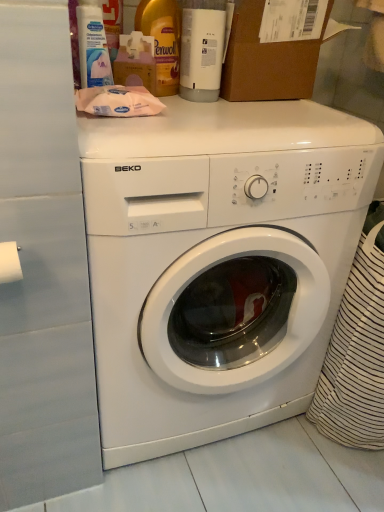
Question: Considering the relative positions of yellow plastic bottle at upper center, the 2th bottle from the right, and white plastic bottle at upper center, which ranks as the first bottle in right-to-left order, in the image provided, is yellow plastic bottle at upper center, the 2th bottle from the right, to the right of white plastic bottle at upper center, which ranks as the first bottle in right-to-left order, from the viewer's perspective?

Choices:
 (A) no
 (B) yes

Answer: (A)

Question: Is yellow plastic bottle at upper center, which ranks as the 1th bottle in left-to-right order, closer to camera compared to white plastic bottle at upper center, which ranks as the first bottle in right-to-left order?

Choices:
 (A) no
 (B) yes

Answer: (A)

Question: Does yellow plastic bottle at upper center, the 2th bottle from the right, have a lesser height compared to white plastic bottle at upper center, acting as the second bottle starting from the left?

Choices:
 (A) no
 (B) yes

Answer: (B)

Question: From a real-world perspective, is yellow plastic bottle at upper center, the 2th bottle from the right, located higher than white plastic bottle at upper center, acting as the second bottle starting from the left?

Choices:
 (A) yes
 (B) no

Answer: (B)

Question: From a real-world perspective, does yellow plastic bottle at upper center, the 2th bottle from the right, sit lower than white plastic bottle at upper center, acting as the second bottle starting from the left?

Choices:
 (A) yes
 (B) no

Answer: (A)

Question: Can you confirm if yellow plastic bottle at upper center, which ranks as the 1th bottle in left-to-right order, is taller than white plastic bottle at upper center, acting as the second bottle starting from the left?

Choices:
 (A) no
 (B) yes

Answer: (A)

Question: Is white plastic bottle at upper left behind white matte toilet paper at left?

Choices:
 (A) yes
 (B) no

Answer: (A)

Question: Is white matte toilet paper at left at the back of white plastic bottle at upper left?

Choices:
 (A) yes
 (B) no

Answer: (B)

Question: Is white plastic bottle at upper left not close to white matte toilet paper at left?

Choices:
 (A) yes
 (B) no

Answer: (B)

Question: Considering the relative sizes of white plastic bottle at upper left and white matte toilet paper at left in the image provided, is white plastic bottle at upper left smaller than white matte toilet paper at left?

Choices:
 (A) no
 (B) yes

Answer: (A)

Question: Could you tell me if white plastic bottle at upper left is turned towards white matte toilet paper at left?

Choices:
 (A) no
 (B) yes

Answer: (A)

Question: Is white plastic bottle at upper left shorter than white matte toilet paper at left?

Choices:
 (A) no
 (B) yes

Answer: (A)

Question: Is brown cardboard box at upper center wider than yellow plastic bottle at upper center, which ranks as the 1th bottle in left-to-right order?

Choices:
 (A) no
 (B) yes

Answer: (B)